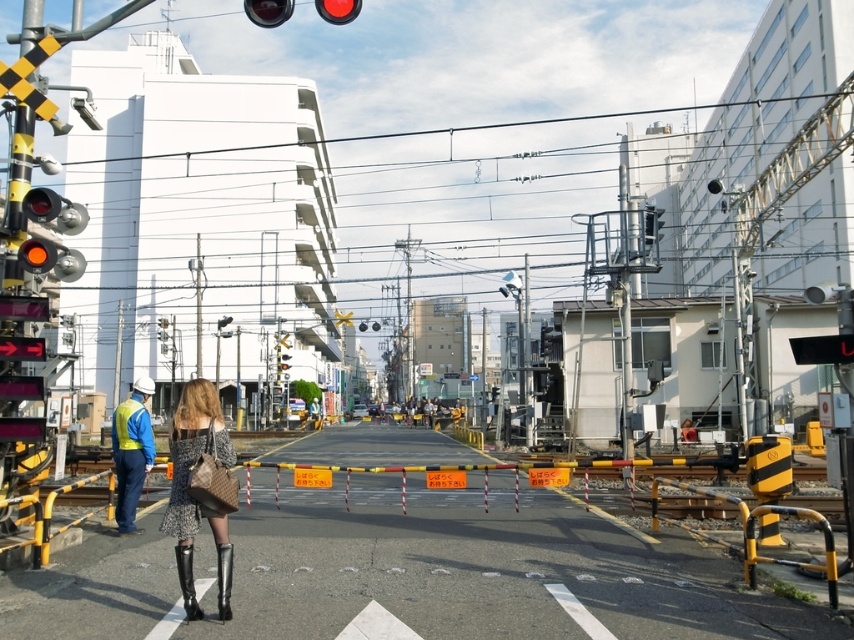
Question: Does knit fabric dress at center come behind matte glass traffic light at upper center?

Choices:
 (A) yes
 (B) no

Answer: (B)

Question: Is knit fabric dress at center above red glass traffic light at upper center?

Choices:
 (A) no
 (B) yes

Answer: (A)

Question: Which point is farther to the camera?

Choices:
 (A) (349, 17)
 (B) (346, 19)
 (C) (227, 560)
 (D) (261, 8)

Answer: (A)

Question: Is matte glass traffic light at upper center closer to the viewer compared to leather high-heeled boot at center?

Choices:
 (A) no
 (B) yes

Answer: (A)

Question: Which object is positioned farthest from the leather high-heeled boot at center?

Choices:
 (A) red glass traffic light at upper center
 (B) matte glass traffic light at upper center
 (C) matte black traffic light at upper center
 (D) knit fabric dress at center

Answer: (C)

Question: Estimate the real-world distances between objects in this image. Which object is farther from the matte glass traffic light at upper center?

Choices:
 (A) red glass traffic light at upper center
 (B) matte black traffic light at upper center
 (C) leather high-heeled boot at lower left

Answer: (C)